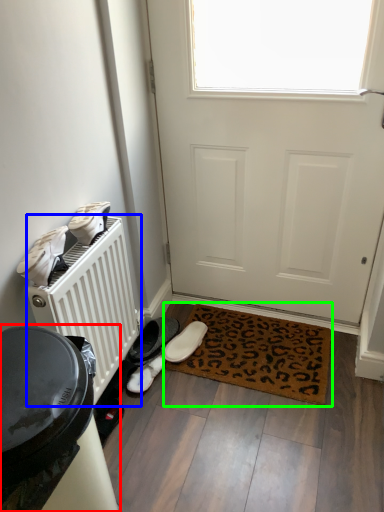
Question: Estimate the real-world distances between objects in this image. Which object is closer to appliance (highlighted by a red box), radiator (highlighted by a blue box) or mat (highlighted by a green box)?

Choices:
 (A) radiator
 (B) mat

Answer: (A)